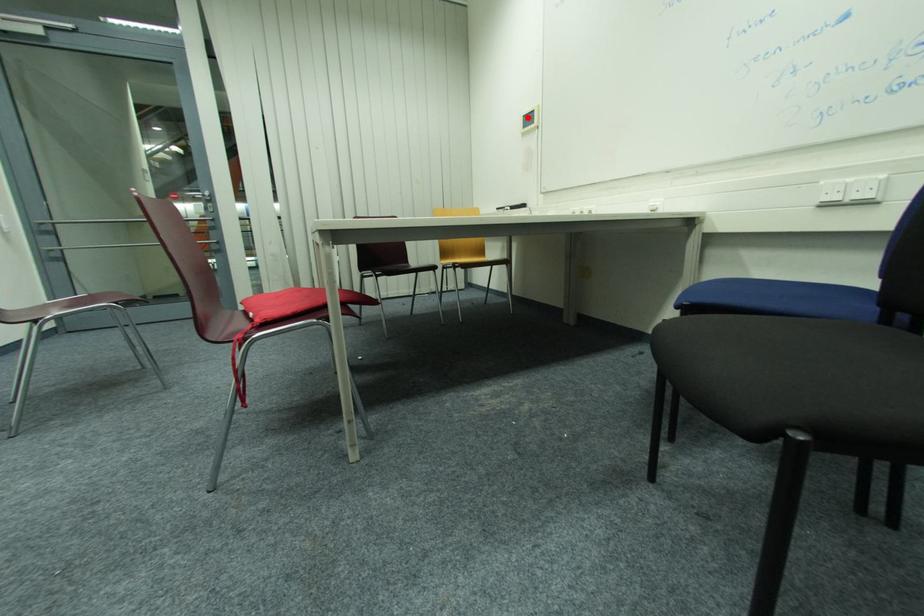
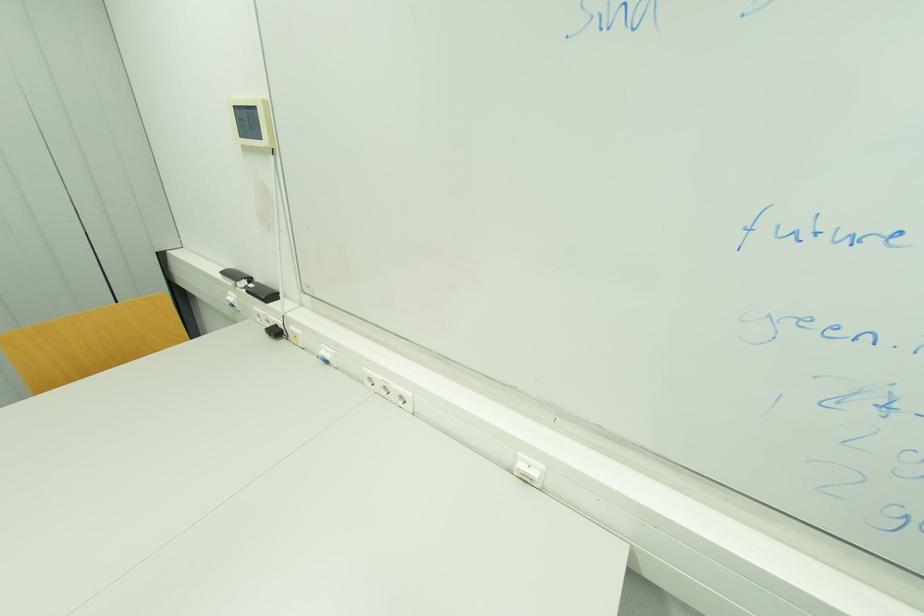
Locate, in the second image, the point that corresponds to the highlighted location in the first image.

(237, 108)